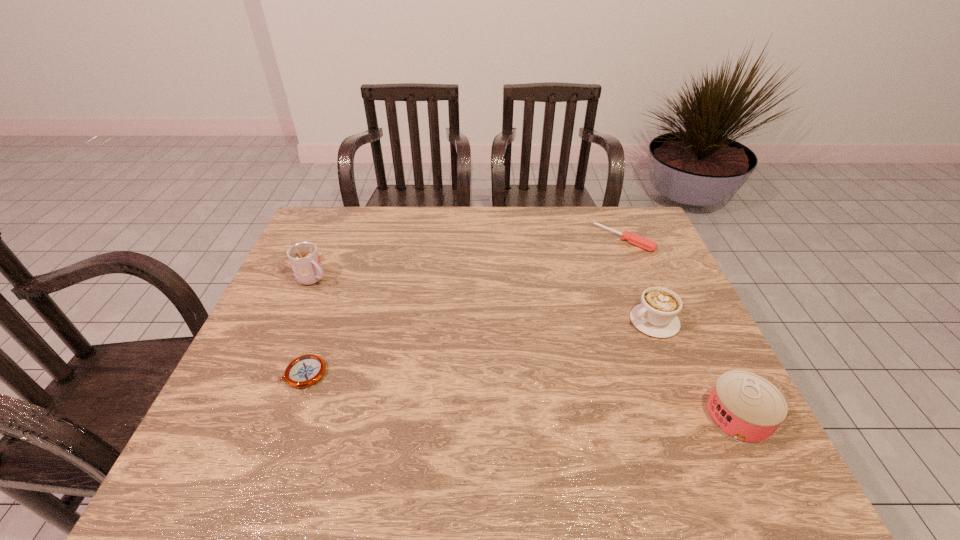
The width and height of the screenshot is (960, 540). Find the location of `compass`. compass is located at coordinates (304, 371).

Where is `the fourth farthest object`? This screenshot has width=960, height=540. the fourth farthest object is located at coordinates (304, 371).

The width and height of the screenshot is (960, 540). In order to click on the nearest object in this screenshot , I will do `click(747, 408)`.

Where is `the third nearest object`? The height and width of the screenshot is (540, 960). the third nearest object is located at coordinates (656, 316).

The height and width of the screenshot is (540, 960). Find the location of `screwdriver`. screwdriver is located at coordinates (644, 243).

You are a GUI agent. You are given a task and a screenshot of the screen. Output one action in this format:
    pyautogui.click(x=<x>, y=<y>)
    Task: Click on the fourth tallest object
    The height and width of the screenshot is (540, 960).
    Given the screenshot: What is the action you would take?
    pyautogui.click(x=644, y=243)

The width and height of the screenshot is (960, 540). I want to click on the second farthest object, so click(304, 258).

Locate an element on the screen. the tallest object is located at coordinates (304, 258).

Find the location of `free point located 0.190m on the right of the compass`. free point located 0.190m on the right of the compass is located at coordinates point(405,373).

The width and height of the screenshot is (960, 540). I want to click on vacant position located on the back of the nearest object, so click(698, 335).